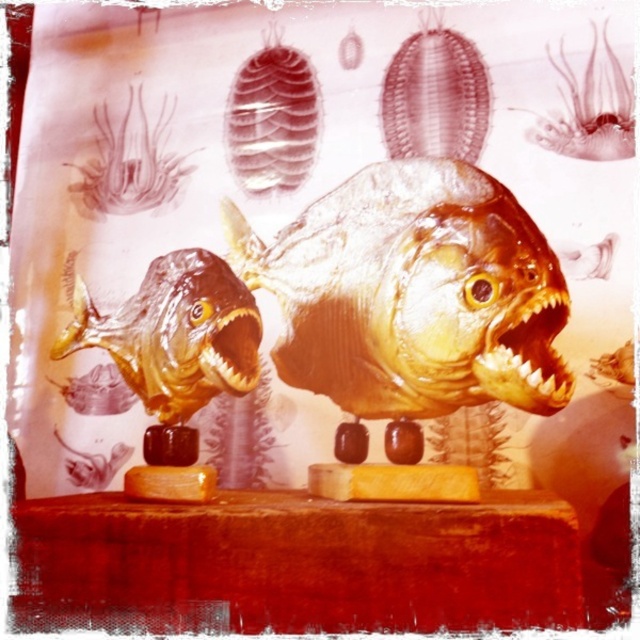
Does translucent amber fish at upper left come in front of translucent amber mouth at center?

That is False.

Is point (124, 186) less distant than point (205, 371)?

No, (124, 186) is behind (205, 371).

Find the location of a particular element. The height and width of the screenshot is (640, 640). translucent amber fish at upper left is located at coordinates (129, 161).

Between shiny brown fish at left and translucent amber fish at center, which one is positioned higher?

translucent amber fish at center is above.

Find the location of a particular element. The width and height of the screenshot is (640, 640). shiny brown fish at left is located at coordinates (176, 333).

I want to click on shiny brown fish at left, so click(x=176, y=333).

Looking at this image, is shiny brown fish at left shorter than translucent amber mouth at center?

In fact, shiny brown fish at left may be taller than translucent amber mouth at center.

Find the location of a particular element. Image resolution: width=640 pixels, height=640 pixels. shiny brown fish at left is located at coordinates (176, 333).

Where is `shiny brown fish at left`? The height and width of the screenshot is (640, 640). shiny brown fish at left is located at coordinates (176, 333).

The image size is (640, 640). Identify the location of shiny brown fish at left. (176, 333).